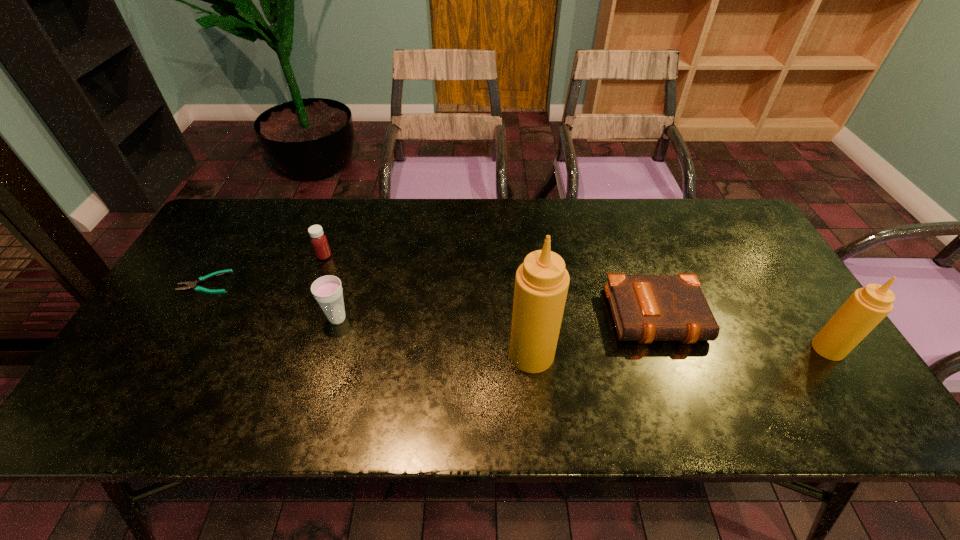
Locate an element on the screen. The width and height of the screenshot is (960, 540). vacant region at the far edge of the desktop is located at coordinates (296, 247).

This screenshot has width=960, height=540. Find the location of `vacant space at the near edge`. vacant space at the near edge is located at coordinates (642, 376).

The width and height of the screenshot is (960, 540). What are the coordinates of `free location at the right edge` in the screenshot? It's located at (771, 329).

At what (x,y) coordinates should I click in order to perform the action: click on vacant area at the far left corner of the desktop. Please return your answer as a coordinate pair (x, y). Looking at the image, I should click on (253, 231).

Find the location of a particular element. Image resolution: width=960 pixels, height=540 pixels. empty space that is in between the right condiment and the taller condiment is located at coordinates (680, 352).

Identify the location of free point between the Bible and the shortest object. Image resolution: width=960 pixels, height=540 pixels. (433, 300).

Image resolution: width=960 pixels, height=540 pixels. Find the location of `vacant point located between the fifth shortest object and the left condiment`. vacant point located between the fifth shortest object and the left condiment is located at coordinates (680, 352).

Locate an element on the screen. The image size is (960, 540). vacant space that's between the taller condiment and the farthest object is located at coordinates (428, 305).

Where is `free spot between the third tallest object and the fifth tallest object`? free spot between the third tallest object and the fifth tallest object is located at coordinates (499, 318).

The height and width of the screenshot is (540, 960). In order to click on empty space between the left condiment and the leftmost object in this screenshot , I will do `click(369, 318)`.